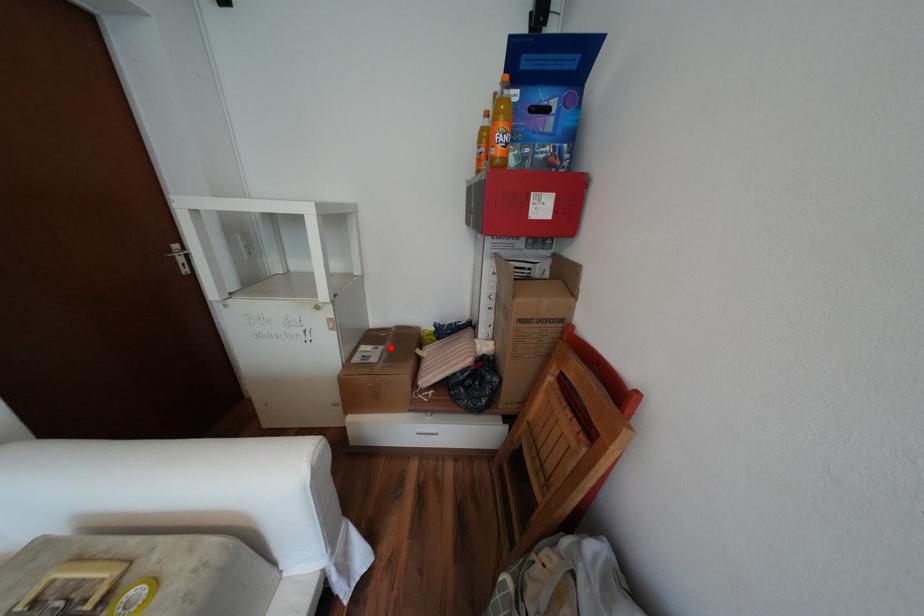
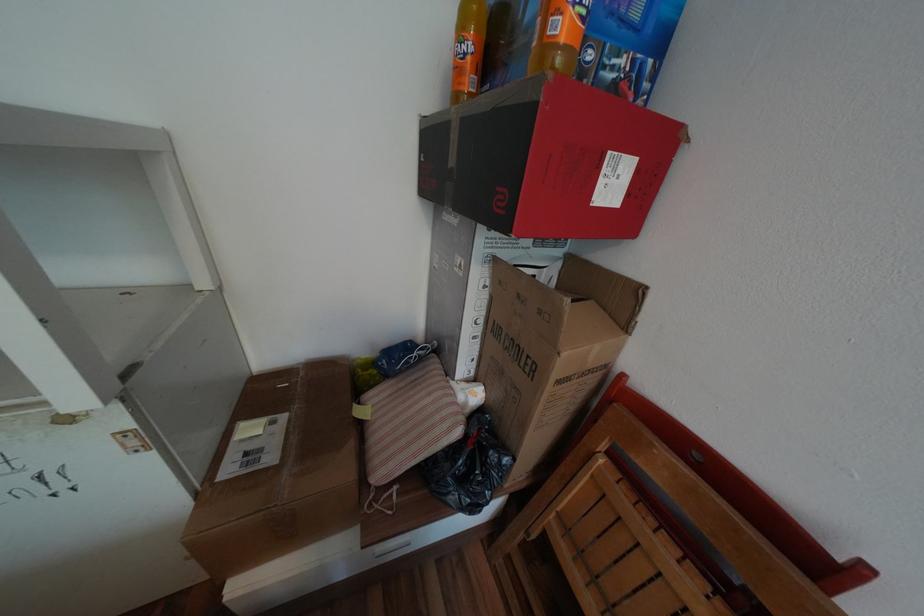
Locate, in the second image, the point that corresponds to the highlighted location in the first image.

(293, 416)